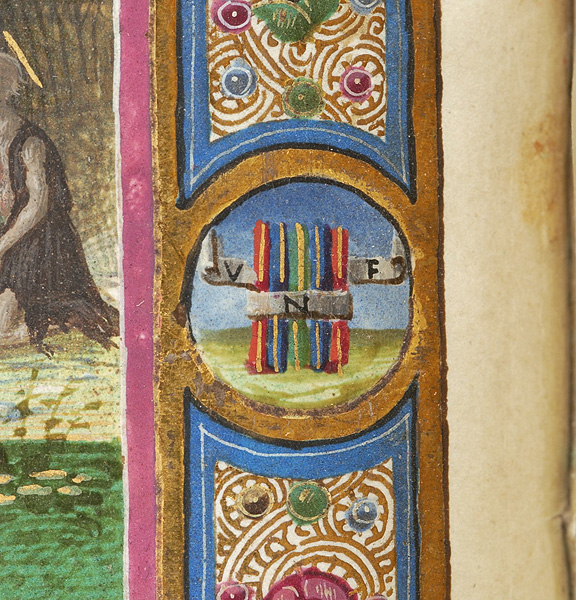
At what (x,y) coordinates should I click in order to perform the action: click on pink horizontal paint. Please return your answer as a coordinate pair (x, y). This screenshot has height=600, width=576. Looking at the image, I should click on (137, 83).